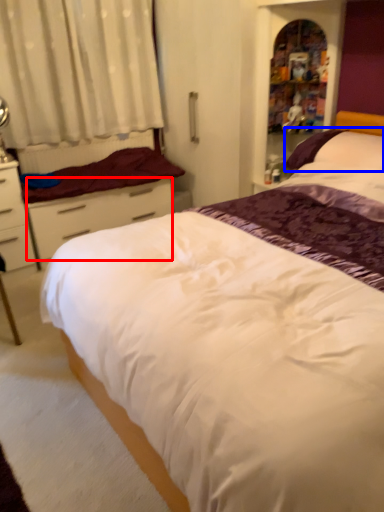
Question: Which object appears farthest to the camera in this image, drawer (highlighted by a red box) or pillow (highlighted by a blue box)?

Choices:
 (A) drawer
 (B) pillow

Answer: (A)